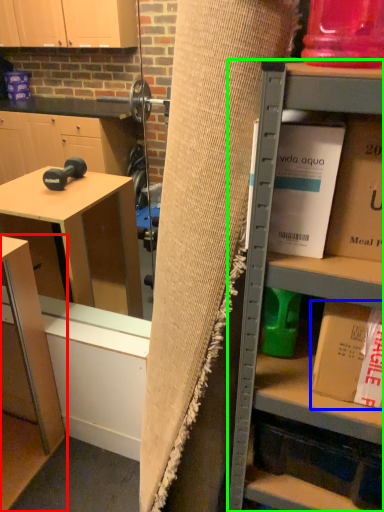
Question: Considering the real-world distances, which object is closest to table (highlighted by a red box)? book (highlighted by a blue box) or shelf (highlighted by a green box).

Choices:
 (A) book
 (B) shelf

Answer: (B)